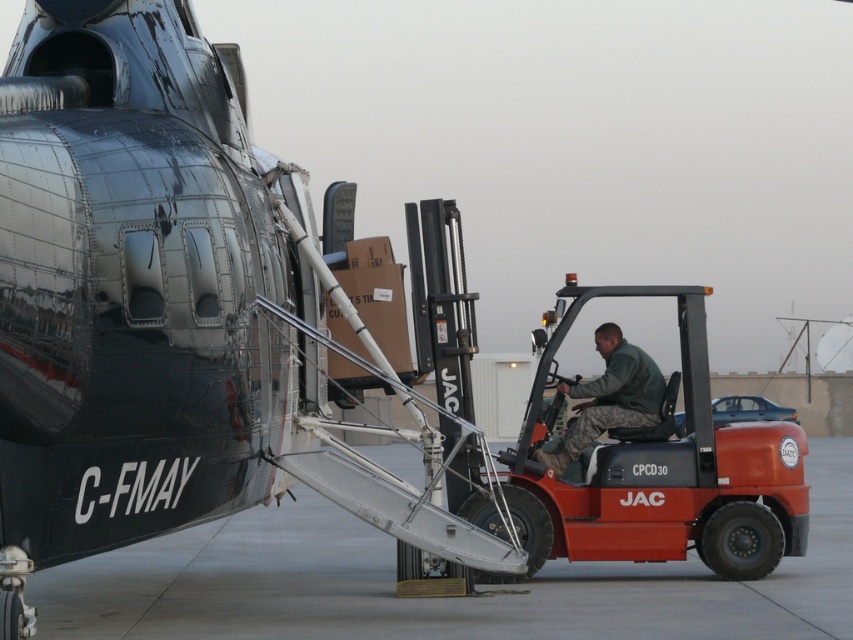
Which of these two, metallic gray tarmac at lower center or camouflage fabric uniform at right, stands taller?

Standing taller between the two is camouflage fabric uniform at right.

Which is above, metallic gray tarmac at lower center or camouflage fabric uniform at right?

Positioned higher is camouflage fabric uniform at right.

Who is more distant from viewer, (618, 598) or (585, 433)?

Point (585, 433)

Find the location of a particular element. Image resolution: width=853 pixels, height=640 pixels. metallic gray tarmac at lower center is located at coordinates (438, 598).

How far apart are shiny metallic airplane at center and camouflage fabric uniform at right?

11.04 feet

Does shiny metallic airplane at center have a larger size compared to camouflage fabric uniform at right?

Actually, shiny metallic airplane at center might be smaller than camouflage fabric uniform at right.

The height and width of the screenshot is (640, 853). What do you see at coordinates (160, 305) in the screenshot?
I see `shiny metallic airplane at center` at bounding box center [160, 305].

At what (x,y) coordinates should I click in order to perform the action: click on shiny metallic airplane at center. Please return your answer as a coordinate pair (x, y). The width and height of the screenshot is (853, 640). Looking at the image, I should click on (160, 305).

Locate an element on the screen. shiny metallic airplane at center is located at coordinates (160, 305).

Can you confirm if shiny metallic airplane at center is taller than metallic gray tarmac at lower center?

No.

What do you see at coordinates (160, 305) in the screenshot? The height and width of the screenshot is (640, 853). I see `shiny metallic airplane at center` at bounding box center [160, 305].

Where is `shiny metallic airplane at center`? This screenshot has height=640, width=853. shiny metallic airplane at center is located at coordinates (160, 305).